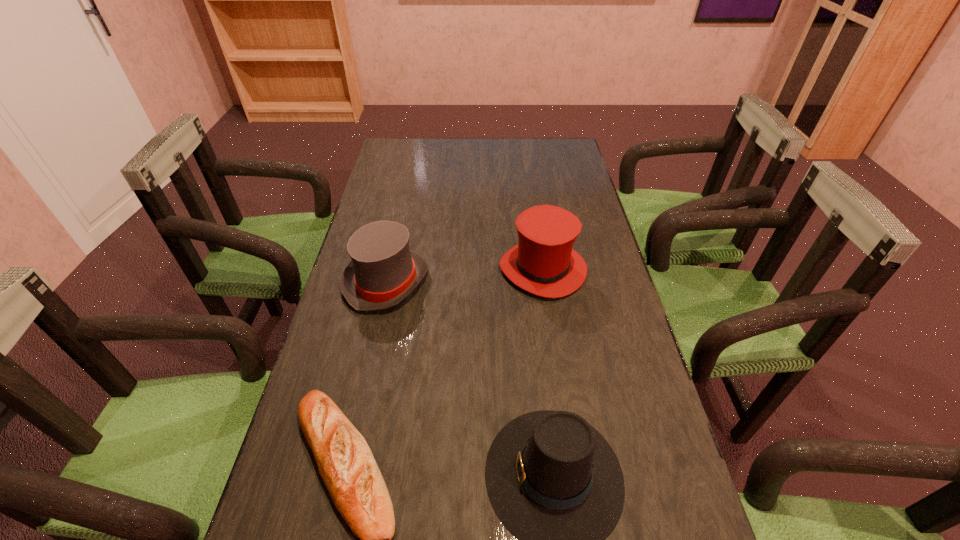
Point out which dress hat is positioned as the nearest to the nearest dress hat. Please provide its 2D coordinates. Your answer should be formatted as a tuple, i.e. [(x, y)], where the tuple contains the x and y coordinates of a point satisfying the conditions above.

[(383, 271)]

Locate which dress hat is the closest to the shortest object. Please provide its 2D coordinates. Your answer should be formatted as a tuple, i.e. [(x, y)], where the tuple contains the x and y coordinates of a point satisfying the conditions above.

[(554, 482)]